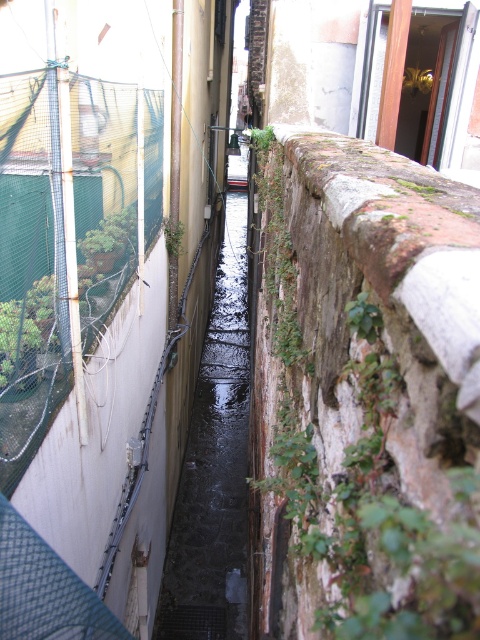
Question: Which point is closer to the camera taking this photo?

Choices:
 (A) (169, 563)
 (B) (272, 324)
 (C) (364, 332)
 (D) (167, 243)

Answer: (C)

Question: Which object is closer to the camera taking this photo?

Choices:
 (A) black concrete water at center
 (B) green leafy plant at upper center
 (C) green mossy wall at upper right

Answer: (B)

Question: Which of the following is the farthest from the observer?

Choices:
 (A) green leafy plant at upper center
 (B) green mossy wall at upper right

Answer: (B)

Question: Is green leafy plant at upper center bigger than green leafy plant at center?

Choices:
 (A) yes
 (B) no

Answer: (B)

Question: In this image, where is black concrete water at center located relative to green leafy plant at upper center?

Choices:
 (A) below
 (B) above

Answer: (B)

Question: Does green leafy plant at upper center appear on the left side of green leafy plant at center?

Choices:
 (A) yes
 (B) no

Answer: (B)